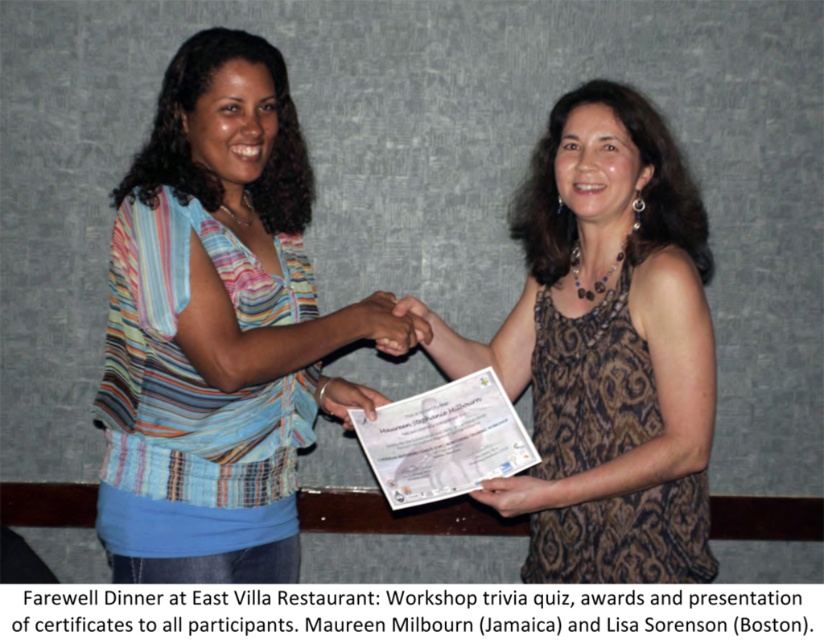
You are a photographer at East Villa Restaurant and need to capture a photo of the striped fabric blouse at center and the brown textured dress at center. Which one is located higher in the frame?

The brown textured dress at center is higher in the frame because the striped fabric blouse at center is positioned under it.

You are a photographer at East Villa Restaurant and need to ensure that both the striped fabric blouse at center and the brown textured dress at center are visible in a group photo. Given that the camera frame can only accommodate items up to the width of the wider object, will both fit within the frame?

The striped fabric blouse at center is narrower than the brown textured dress at center. Since the camera frame can accommodate up to the width of the wider object, which is the brown textured dress at center, both the striped fabric blouse at center and the brown textured dress at center will fit within the frame.